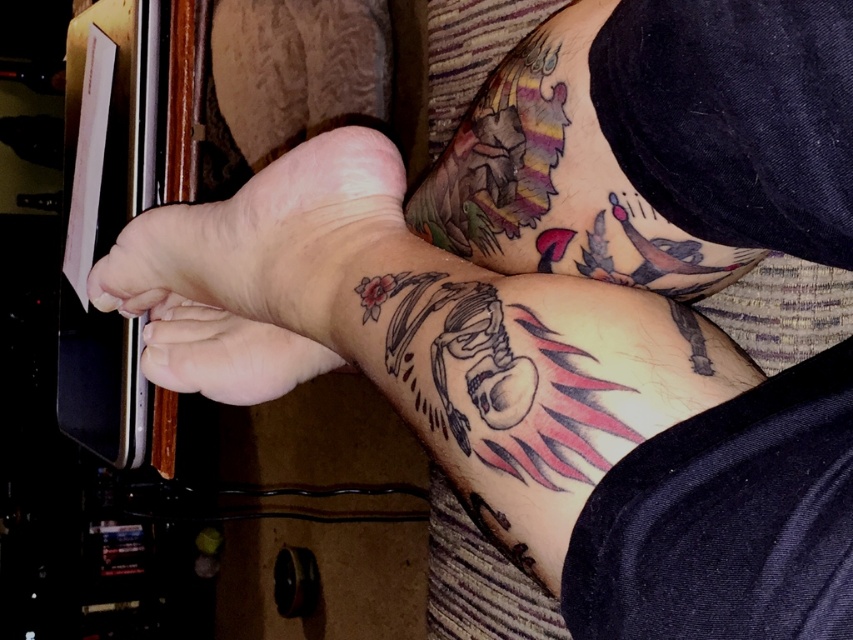
Is point (212, 378) farther from camera compared to point (263, 380)?

No, (212, 378) is in front of (263, 380).

Is point (273, 237) positioned behind point (199, 364)?

That is False.

Locate an element on the screen. Image resolution: width=853 pixels, height=640 pixels. skinsmoothhand at center is located at coordinates (215, 298).

Is skin at center shorter than skinsmoothhand at center?

Indeed, skin at center has a lesser height compared to skinsmoothhand at center.

The height and width of the screenshot is (640, 853). Describe the element at coordinates (262, 237) in the screenshot. I see `skin at center` at that location.

Is point (262, 273) closer to viewer compared to point (213, 246)?

Yes, point (262, 273) is in front of point (213, 246).

The height and width of the screenshot is (640, 853). In order to click on skin at center in this screenshot , I will do `click(262, 237)`.

Which is in front, point (230, 256) or point (223, 349)?

Positioned in front is point (230, 256).

Which is more to the right, skin at center or matte skin at center?

Positioned to the right is skin at center.

Between point (194, 250) and point (190, 349), which one is positioned behind?

Positioned behind is point (190, 349).

Where is `skin at center`? This screenshot has width=853, height=640. skin at center is located at coordinates (262, 237).